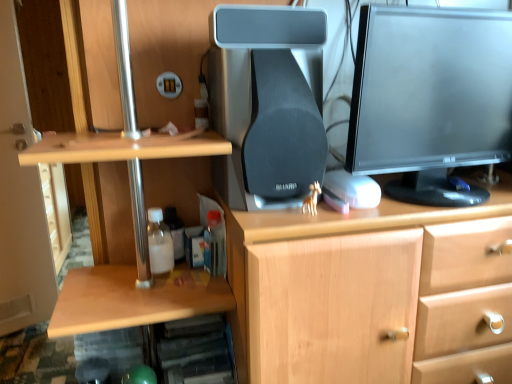
Question: From a real-world perspective, is translucent plastic bottle at lower left, arranged as the 1th bottle when viewed from the left, below translucent plastic bottle at lower center, the first bottle viewed from the right?

Choices:
 (A) yes
 (B) no

Answer: (B)

Question: Does translucent plastic bottle at lower left, arranged as the 1th bottle when viewed from the left, appear on the right side of translucent plastic bottle at lower center, the first bottle viewed from the right?

Choices:
 (A) no
 (B) yes

Answer: (A)

Question: Does translucent plastic bottle at lower left, arranged as the 1th bottle when viewed from the left, have a greater width compared to translucent plastic bottle at lower center, the first bottle viewed from the right?

Choices:
 (A) no
 (B) yes

Answer: (B)

Question: From the image's perspective, would you say translucent plastic bottle at lower left, arranged as the 2th bottle when viewed from the right, is shown under translucent plastic bottle at lower center, the first bottle viewed from the right?

Choices:
 (A) yes
 (B) no

Answer: (B)

Question: Does translucent plastic bottle at lower left, arranged as the 1th bottle when viewed from the left, have a greater height compared to translucent plastic bottle at lower center, acting as the second bottle starting from the left?

Choices:
 (A) yes
 (B) no

Answer: (A)

Question: From the image's perspective, is translucent plastic bottle at lower left, arranged as the 1th bottle when viewed from the left, above or below matte black monitor at upper right?

Choices:
 (A) below
 (B) above

Answer: (A)

Question: In terms of width, does translucent plastic bottle at lower left, arranged as the 2th bottle when viewed from the right, look wider or thinner when compared to matte black monitor at upper right?

Choices:
 (A) thin
 (B) wide

Answer: (A)

Question: In terms of size, does translucent plastic bottle at lower left, arranged as the 1th bottle when viewed from the left, appear bigger or smaller than matte black monitor at upper right?

Choices:
 (A) big
 (B) small

Answer: (B)

Question: From their relative heights in the image, would you say translucent plastic bottle at lower left, arranged as the 1th bottle when viewed from the left, is taller or shorter than matte black monitor at upper right?

Choices:
 (A) tall
 (B) short

Answer: (B)

Question: In terms of width, does matte black monitor at upper right look wider or thinner when compared to black matte speaker at center?

Choices:
 (A) thin
 (B) wide

Answer: (A)

Question: From a real-world perspective, is matte black monitor at upper right physically located above or below black matte speaker at center?

Choices:
 (A) above
 (B) below

Answer: (A)

Question: From the image's perspective, is matte black monitor at upper right above or below black matte speaker at center?

Choices:
 (A) below
 (B) above

Answer: (B)

Question: Is point (468, 77) positioned closer to the camera than point (263, 208)?

Choices:
 (A) closer
 (B) farther

Answer: (B)

Question: Is black matte speaker at center inside the boundaries of translucent plastic bottle at lower left, arranged as the 2th bottle when viewed from the right, or outside?

Choices:
 (A) inside
 (B) outside

Answer: (B)

Question: Visually, is black matte speaker at center positioned to the left or to the right of translucent plastic bottle at lower left, arranged as the 2th bottle when viewed from the right?

Choices:
 (A) right
 (B) left

Answer: (A)